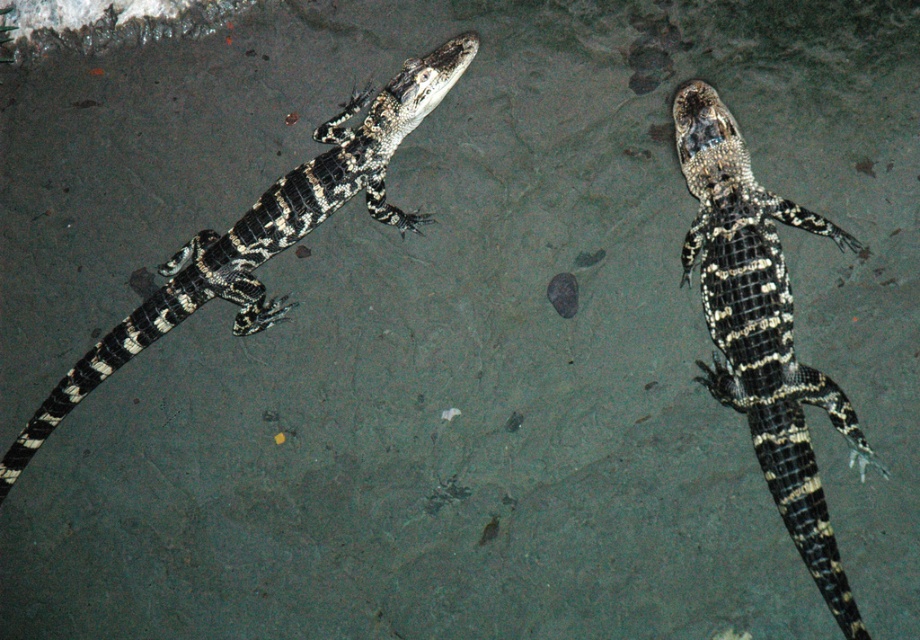
You are an animal caretaker observing two alligators. You notice their shiny black scales at upper right and shiny black scales at left. Which set of scales is smaller in size?

The shiny black scales at upper right are smaller in size compared to the shiny black scales at left.

You are a wildlife photographer aiming to capture closeup shots of the shiny black scales at upper right and the shiny black scales at left. Since the scales are on alligators, you need to ensure your equipment can handle the rough terrain. Which set of scales requires a wider lens to capture the entire structure in one frame?

The shiny black scales at upper right is thinner than the shiny black scales at left, so you need a wider lens to capture the entire structure of the shiny black scales at upper right in one frame because it is narrower.

You are an animal caretaker who needs to apply a topical treatment to the shiny black scales at upper right and the shiny black scales at left. Since the treatment requires you to work from left to right, which scales should you treat first?

You should treat the shiny black scales at left first because they are positioned to the left of the shiny black scales at upper right, so working from left to right, you start with the left one.